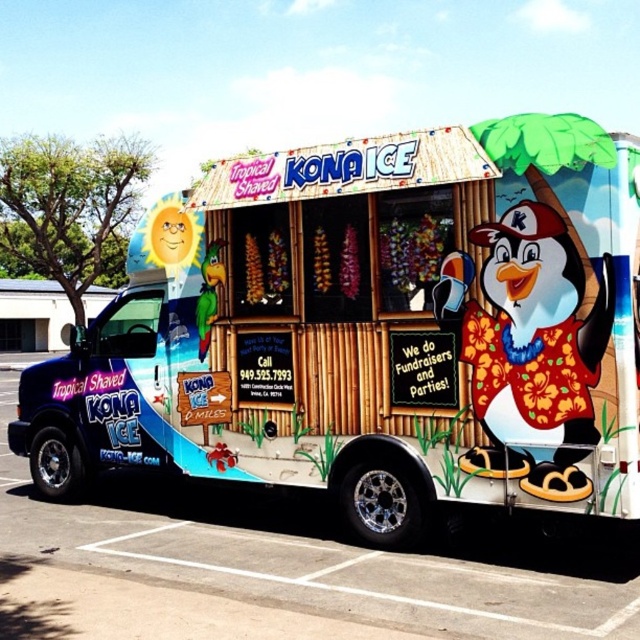
You are standing at the origin point of the coordinate system. The truck is at coordinates given in the description. Can you determine the direction of the matte blue truck at center from your current position?

The matte blue truck at center is located at coordinates approximately 0.519 on the x axis and 0.584 on the y axis. Since you are at the origin point, the truck is northeast of your current position.